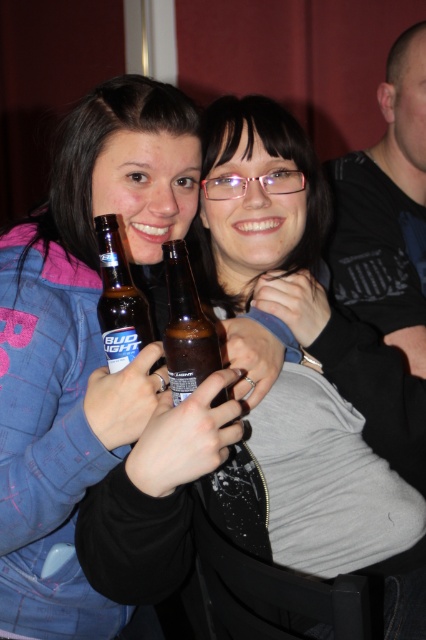
You are an interior designer planning to hang a picture frame at point 0.548, 0.183 on the wall. The matte black jacket at center is currently at that position. Can you hang the frame there without moving the jacket?

The matte black jacket at center is already positioned at point (77, 349), so you cannot hang the frame there without moving the jacket.

You are holding a 25 inch ruler and want to measure the distance between yourself and the brown glass bottle at center. Can you determine if the ruler will be long enough to reach the bottle?

The distance between the brown glass bottle at center and the viewer is 25.42 inches, so the 25 inch ruler is slightly too short to fully measure the distance.

You are taking a photo of two friends holding beer bottles. The scene shows a brown glass bottle at center and a matte brown bottle at center. Which bottle is closer to the camera?

The brown glass bottle at center is closer to the camera because it is in front of the matte brown bottle at center.